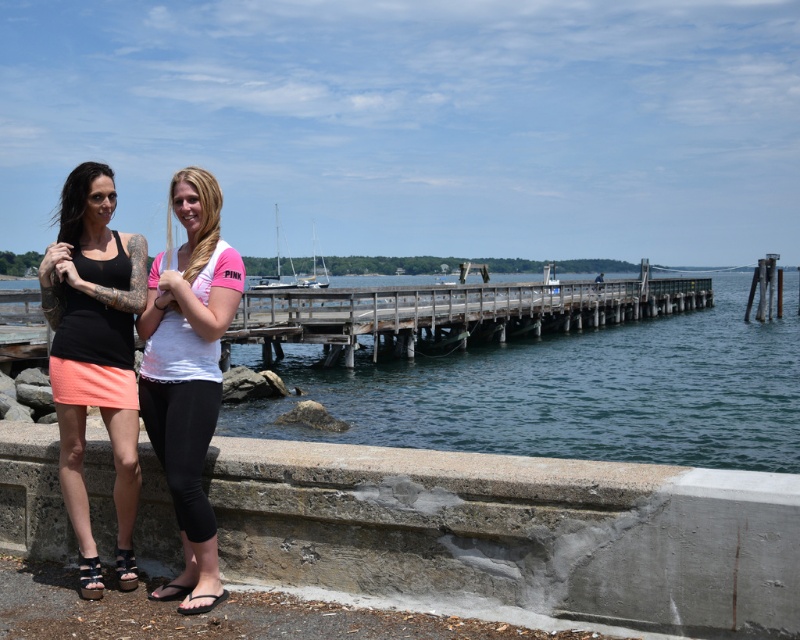
Question: From the image, what is the correct spatial relationship of white matte t-shirt at center in relation to wooden at center?

Choices:
 (A) above
 (B) below

Answer: (B)

Question: Which point is closer to the camera?

Choices:
 (A) (220, 244)
 (B) (668, 292)
 (C) (721, 282)

Answer: (A)

Question: Which point appears farthest from the camera in this image?

Choices:
 (A) (174, 401)
 (B) (658, 278)

Answer: (B)

Question: Can you confirm if concrete ledge at lower center is positioned to the right of clear blue water at center?

Choices:
 (A) yes
 (B) no

Answer: (B)

Question: Is matte black tank top at left below wooden at center?

Choices:
 (A) no
 (B) yes

Answer: (B)

Question: Which of these objects is positioned closest to the concrete ledge at lower center?

Choices:
 (A) clear blue water at center
 (B) matte black tank top at left
 (C) white matte t-shirt at center
 (D) wooden at center

Answer: (C)